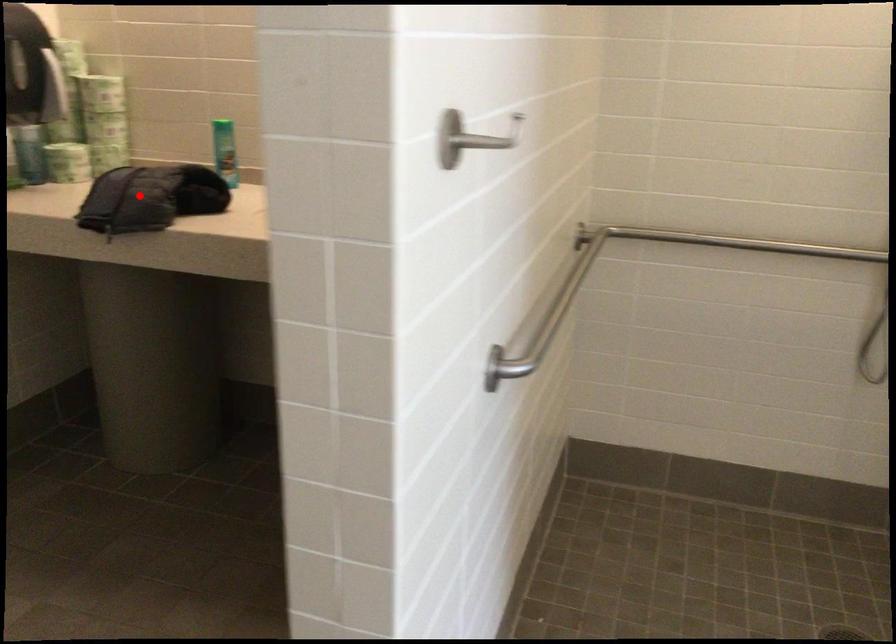
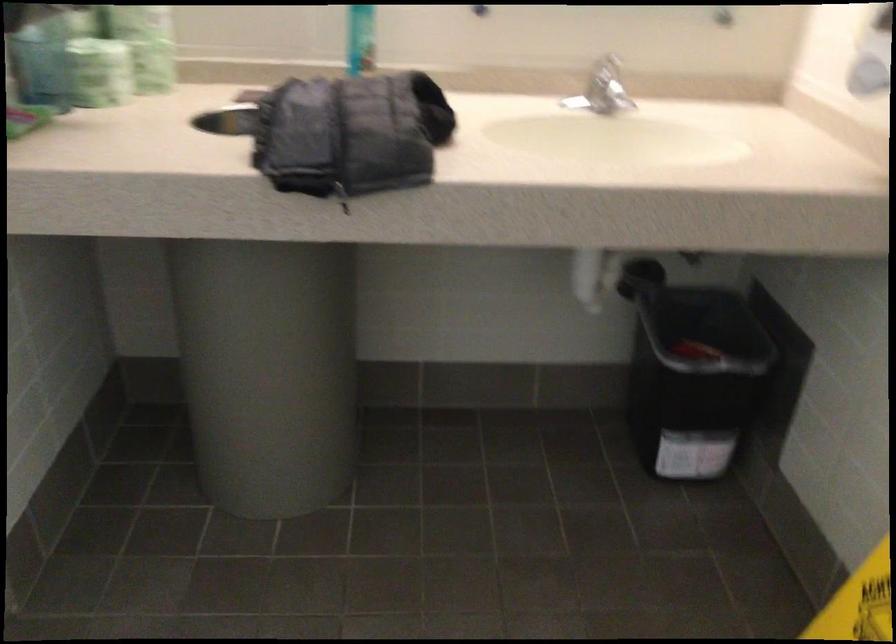
Locate, in the second image, the point that corresponds to the highlighted location in the first image.

(350, 134)